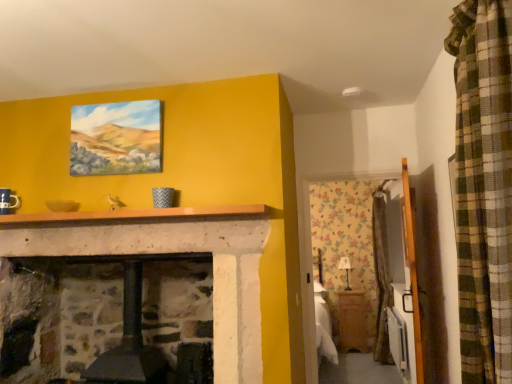
Question: Considering the relative positions of smooth stone mantle at center and matte canvas painting at upper center in the image provided, is smooth stone mantle at center to the left or to the right of matte canvas painting at upper center?

Choices:
 (A) right
 (B) left

Answer: (A)

Question: From the image's perspective, is smooth stone mantle at center positioned above or below matte canvas painting at upper center?

Choices:
 (A) above
 (B) below

Answer: (B)

Question: Estimate the real-world distances between objects in this image. Which object is closer to the wooden armoire at right?

Choices:
 (A) smooth stone mantle at center
 (B) wooden cabinet at lower right
 (C) matte canvas painting at upper center

Answer: (B)

Question: Which is nearer to the wooden armoire at right?

Choices:
 (A) wooden cabinet at lower right
 (B) matte canvas painting at upper center
 (C) smooth stone mantle at center

Answer: (A)